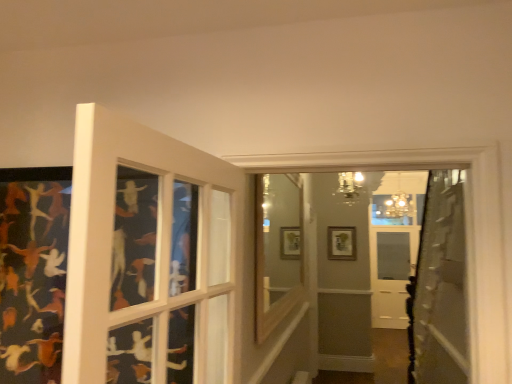
What is the approximate height of metallic chandelier at upper center, the 1th light fixture when ordered from front to back?

13.66 inches.

I want to click on matte gold chandelier at upper center, which ranks as the 2th light fixture in left-to-right order, so click(399, 202).

Measure the distance between matte gold chandelier at upper center, which is the 2th light fixture from front to back, and camera.

A distance of 5.65 meters exists between matte gold chandelier at upper center, which is the 2th light fixture from front to back, and camera.

Find the location of a particular element. Image resolution: width=512 pixels, height=384 pixels. wooden picture frame at center is located at coordinates (341, 243).

Where is `wooden window frame at center`? The image size is (512, 384). wooden window frame at center is located at coordinates (277, 249).

Is wooden picture frame at center looking in the opposite direction of matte gold chandelier at upper center, which ranks as the 2th light fixture in left-to-right order?

wooden picture frame at center is not turned away from matte gold chandelier at upper center, which ranks as the 2th light fixture in left-to-right order.

The width and height of the screenshot is (512, 384). Identify the location of light fixture on the right of the wooden picture frame at center. (399, 202).

Can you confirm if wooden picture frame at center is wider than matte gold chandelier at upper center, which is the 2th light fixture from front to back?

Incorrect, the width of wooden picture frame at center does not surpass that of matte gold chandelier at upper center, which is the 2th light fixture from front to back.

Can you confirm if wooden picture frame at center is positioned to the left of matte gold chandelier at upper center, which is the 2th light fixture from front to back?

Yes.

Is metallic chandelier at upper center, which ranks as the 1th light fixture in left-to-right order, surrounding wooden picture frame at center?

No, metallic chandelier at upper center, which ranks as the 1th light fixture in left-to-right order, does not contain wooden picture frame at center.

Considering the sizes of metallic chandelier at upper center, which ranks as the 1th light fixture in left-to-right order, and wooden picture frame at center in the image, is metallic chandelier at upper center, which ranks as the 1th light fixture in left-to-right order, wider or thinner than wooden picture frame at center?

Considering their sizes, metallic chandelier at upper center, which ranks as the 1th light fixture in left-to-right order, looks broader than wooden picture frame at center.

Is metallic chandelier at upper center, the second light fixture when ordered from back to front, looking in the opposite direction of wooden picture frame at center?

Absolutely, metallic chandelier at upper center, the second light fixture when ordered from back to front, is directed away from wooden picture frame at center.

Between metallic chandelier at upper center, which ranks as the 1th light fixture in left-to-right order, and wooden picture frame at center, which one appears on the left side from the viewer's perspective?

Positioned to the left is metallic chandelier at upper center, which ranks as the 1th light fixture in left-to-right order.

Does point (407, 208) appear closer or farther from the camera than point (284, 312)?

Point (407, 208) is positioned farther from the camera compared to point (284, 312).

Is matte gold chandelier at upper center, which ranks as the 2th light fixture in left-to-right order, at the right side of wooden window frame at center?

Yes, matte gold chandelier at upper center, which ranks as the 2th light fixture in left-to-right order, is to the right of wooden window frame at center.

Considering the relative sizes of matte gold chandelier at upper center, which is the 2th light fixture from front to back, and wooden window frame at center in the image provided, is matte gold chandelier at upper center, which is the 2th light fixture from front to back, shorter than wooden window frame at center?

Yes.

Is matte gold chandelier at upper center, which ranks as the 2th light fixture in left-to-right order, with wooden window frame at center?

No, matte gold chandelier at upper center, which ranks as the 2th light fixture in left-to-right order, is not in contact with wooden window frame at center.

Is wooden picture frame at center turned away from metallic chandelier at upper center, which ranks as the 1th light fixture in left-to-right order?

No, wooden picture frame at center is not facing away from metallic chandelier at upper center, which ranks as the 1th light fixture in left-to-right order.

How different are the orientations of wooden picture frame at center and metallic chandelier at upper center, the second light fixture when ordered from back to front, in degrees?

The angular difference between wooden picture frame at center and metallic chandelier at upper center, the second light fixture when ordered from back to front, is 0.264 degrees.

From the image's perspective, between wooden picture frame at center and metallic chandelier at upper center, the second light fixture when ordered from back to front, who is located below?

wooden picture frame at center is shown below in the image.

Where is `picture frame behind the metallic chandelier at upper center, the 1th light fixture when ordered from front to back`? This screenshot has height=384, width=512. picture frame behind the metallic chandelier at upper center, the 1th light fixture when ordered from front to back is located at coordinates (341, 243).

Can you confirm if metallic chandelier at upper center, the 1th light fixture when ordered from front to back, is wider than wooden window frame at center?

Yes.

At what (x,y) coordinates should I click in order to perform the action: click on window frame below the metallic chandelier at upper center, the 1th light fixture when ordered from front to back (from a real-world perspective). Please return your answer as a coordinate pair (x, y). This screenshot has height=384, width=512. Looking at the image, I should click on (277, 249).

From a real-world perspective, between metallic chandelier at upper center, the 1th light fixture when ordered from front to back, and wooden window frame at center, who is vertically higher?

From a 3D spatial view, metallic chandelier at upper center, the 1th light fixture when ordered from front to back, is above.

Which object is positioned more to the left, metallic chandelier at upper center, the second light fixture when ordered from back to front, or wooden window frame at center?

wooden window frame at center.

Is matte gold chandelier at upper center, which appears as the first light fixture when viewed from the back, not close to metallic chandelier at upper center, which is the second light fixture in right-to-left order?

Yes.

Measure the distance between matte gold chandelier at upper center, which ranks as the 2th light fixture in left-to-right order, and metallic chandelier at upper center, which is the second light fixture in right-to-left order.

1.33 meters.

Between matte gold chandelier at upper center, which ranks as the 2th light fixture in left-to-right order, and metallic chandelier at upper center, the second light fixture when ordered from back to front, which one has larger width?

matte gold chandelier at upper center, which ranks as the 2th light fixture in left-to-right order, is wider.

In the scene shown: What's the angular difference between matte gold chandelier at upper center, which appears as the first light fixture when viewed from the back, and metallic chandelier at upper center, which is the second light fixture in right-to-left order,'s facing directions?

0.956 degrees.

Considering the positions of objects wooden picture frame at center and wooden window frame at center in the image provided, who is behind, wooden picture frame at center or wooden window frame at center?

wooden picture frame at center.

You are a GUI agent. You are given a task and a screenshot of the screen. Output one action in this format:
    pyautogui.click(x=<x>, y=<y>)
    Task: Click on the window frame located above the wooden picture frame at center (from the image's perspective)
    This screenshot has height=384, width=512.
    Given the screenshot: What is the action you would take?
    pyautogui.click(x=277, y=249)

Is wooden picture frame at center far away from wooden window frame at center?

Yes, wooden picture frame at center and wooden window frame at center are quite far apart.

Can you confirm if wooden picture frame at center is positioned to the right of wooden window frame at center?

Yes, wooden picture frame at center is to the right of wooden window frame at center.

At what (x,y) coordinates should I click in order to perform the action: click on light fixture behind the wooden picture frame at center. Please return your answer as a coordinate pair (x, y). The image size is (512, 384). Looking at the image, I should click on (399, 202).

There is a wooden picture frame at center. Identify the location of the 2nd light fixture above it (from the image's perspective). (350, 187).

Looking at the image, which one is located further to wooden window frame at center, matte gold chandelier at upper center, which is the 2th light fixture from front to back, or wooden picture frame at center?

The object further to wooden window frame at center is matte gold chandelier at upper center, which is the 2th light fixture from front to back.

Considering their positions, is matte gold chandelier at upper center, which appears as the first light fixture when viewed from the back, positioned closer to wooden window frame at center than metallic chandelier at upper center, the 1th light fixture when ordered from front to back?

metallic chandelier at upper center, the 1th light fixture when ordered from front to back.

When comparing their distances from matte gold chandelier at upper center, which is the 2th light fixture from front to back, does metallic chandelier at upper center, the second light fixture when ordered from back to front, or wooden window frame at center seem further?

wooden window frame at center is further to matte gold chandelier at upper center, which is the 2th light fixture from front to back.

From the image, which object appears to be farther from matte gold chandelier at upper center, which ranks as the 2th light fixture in left-to-right order, wooden window frame at center or metallic chandelier at upper center, the second light fixture when ordered from back to front?

wooden window frame at center lies further to matte gold chandelier at upper center, which ranks as the 2th light fixture in left-to-right order, than the other object.

From the image, which object appears to be nearer to metallic chandelier at upper center, which ranks as the 1th light fixture in left-to-right order, wooden window frame at center or wooden picture frame at center?

wooden picture frame at center lies closer to metallic chandelier at upper center, which ranks as the 1th light fixture in left-to-right order, than the other object.

Considering their positions, is wooden picture frame at center positioned further to matte gold chandelier at upper center, the first light fixture from the right, than metallic chandelier at upper center, which is the second light fixture in right-to-left order?

Based on the image, metallic chandelier at upper center, which is the second light fixture in right-to-left order, appears to be further to matte gold chandelier at upper center, the first light fixture from the right.

When comparing their distances from wooden window frame at center, does wooden picture frame at center or metallic chandelier at upper center, the 1th light fixture when ordered from front to back, seem closer?

The object closer to wooden window frame at center is metallic chandelier at upper center, the 1th light fixture when ordered from front to back.

From the image, which object appears to be nearer to matte gold chandelier at upper center, the first light fixture from the right, metallic chandelier at upper center, the 1th light fixture when ordered from front to back, or wooden picture frame at center?

Among the two, wooden picture frame at center is located nearer to matte gold chandelier at upper center, the first light fixture from the right.

I want to click on light fixture between wooden window frame at center and wooden picture frame at center from front to back, so click(x=350, y=187).

Identify the location of picture frame located between wooden window frame at center and matte gold chandelier at upper center, which is the 2th light fixture from front to back, in the depth direction. The width and height of the screenshot is (512, 384). (341, 243).

Identify the location of light fixture between wooden window frame at center and matte gold chandelier at upper center, which ranks as the 2th light fixture in left-to-right order, in the front-back direction. (350, 187).

At what (x,y) coordinates should I click in order to perform the action: click on picture frame positioned between metallic chandelier at upper center, the second light fixture when ordered from back to front, and matte gold chandelier at upper center, the first light fixture from the right, from near to far. Please return your answer as a coordinate pair (x, y). Image resolution: width=512 pixels, height=384 pixels. Looking at the image, I should click on (341, 243).